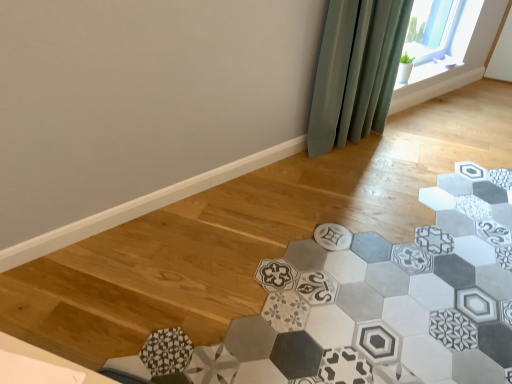
Question: Is green fabric curtain at upper right oriented towards patterned ceramic tile at center?

Choices:
 (A) no
 (B) yes

Answer: (B)

Question: Does green fabric curtain at upper right have a larger size compared to patterned ceramic tile at center?

Choices:
 (A) yes
 (B) no

Answer: (B)

Question: Can you confirm if green fabric curtain at upper right is positioned to the right of patterned ceramic tile at center?

Choices:
 (A) yes
 (B) no

Answer: (A)

Question: Is the depth of green fabric curtain at upper right greater than that of patterned ceramic tile at center?

Choices:
 (A) no
 (B) yes

Answer: (B)

Question: Considering the relative sizes of green fabric curtain at upper right and patterned ceramic tile at center in the image provided, is green fabric curtain at upper right taller than patterned ceramic tile at center?

Choices:
 (A) no
 (B) yes

Answer: (B)

Question: From the image's perspective, is green fabric curtain at upper right on patterned ceramic tile at center?

Choices:
 (A) yes
 (B) no

Answer: (A)

Question: Is patterned ceramic tile at center thinner than green fabric curtain at upper right?

Choices:
 (A) no
 (B) yes

Answer: (A)

Question: Is patterned ceramic tile at center surrounding green fabric curtain at upper right?

Choices:
 (A) yes
 (B) no

Answer: (B)

Question: Considering the relative sizes of patterned ceramic tile at center and green fabric curtain at upper right in the image provided, is patterned ceramic tile at center smaller than green fabric curtain at upper right?

Choices:
 (A) no
 (B) yes

Answer: (A)

Question: Is patterned ceramic tile at center located outside green fabric curtain at upper right?

Choices:
 (A) yes
 (B) no

Answer: (A)

Question: Considering the relative sizes of patterned ceramic tile at center and green fabric curtain at upper right in the image provided, is patterned ceramic tile at center bigger than green fabric curtain at upper right?

Choices:
 (A) yes
 (B) no

Answer: (A)

Question: Is patterned ceramic tile at center oriented towards green fabric curtain at upper right?

Choices:
 (A) no
 (B) yes

Answer: (A)

Question: Considering the relative positions of patterned ceramic tile at center and green fabric curtain at upper right in the image provided, is patterned ceramic tile at center to the left or to the right of green fabric curtain at upper right?

Choices:
 (A) left
 (B) right

Answer: (A)